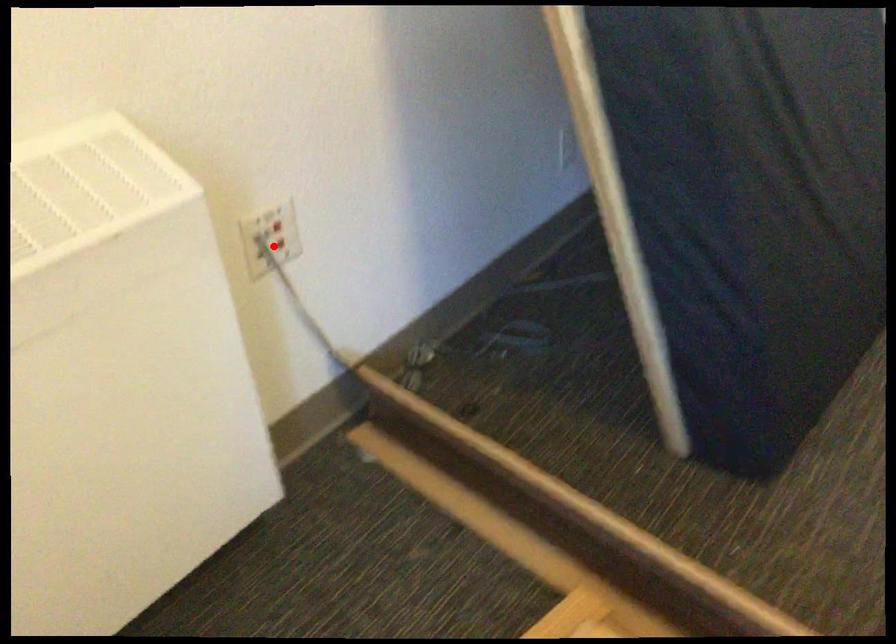
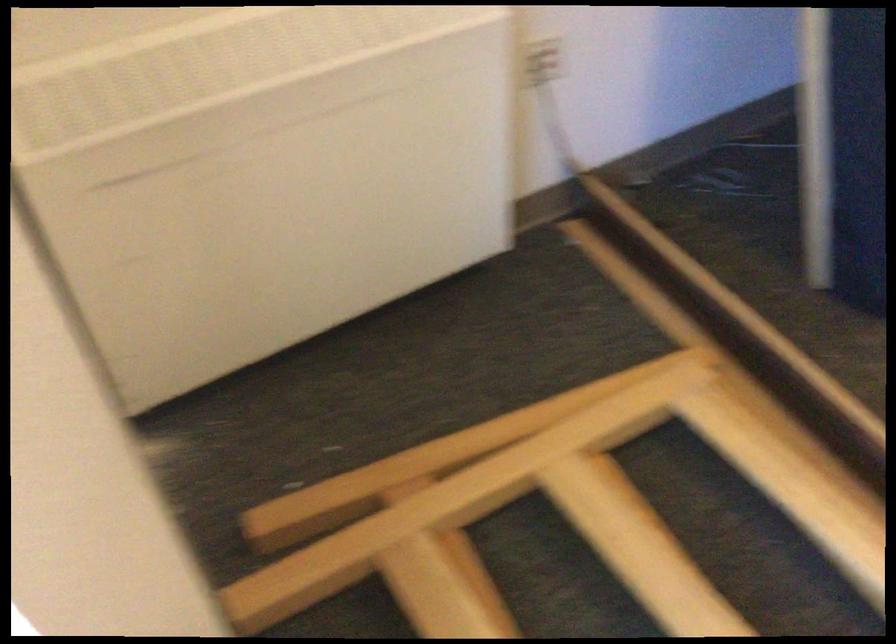
Question: I am providing you with two images of the same scene from different viewpoints. In image1, a red point is highlighted. Considering the same 3D point in image2, which of the following is correct?

Choices:
 (A) It is closer
 (B) It is farther

Answer: (B)